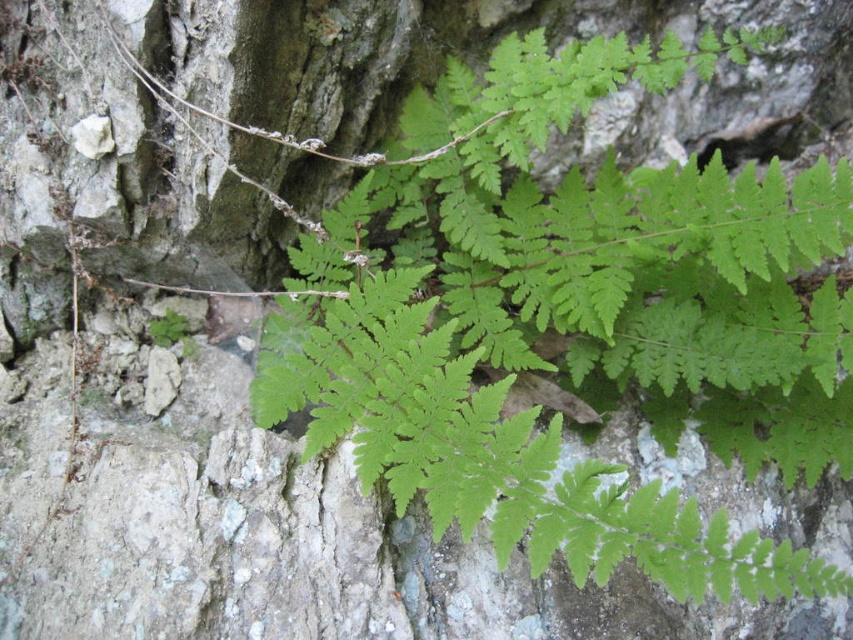
Does green leafy fern at upper right appear over green leafy plant at upper left?

Yes.

Between green leafy fern at upper right and green leafy plant at upper left, which one is positioned lower?

green leafy plant at upper left

Describe the element at coordinates (560, 314) in the screenshot. I see `green leafy fern at upper right` at that location.

This screenshot has width=853, height=640. What are the coordinates of `green leafy fern at upper right` in the screenshot? It's located at (560, 314).